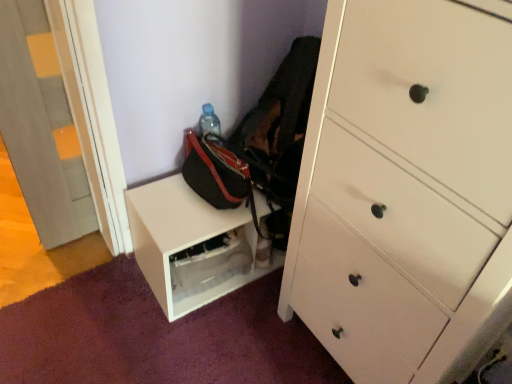
This screenshot has height=384, width=512. In order to click on free space that is to the left of black fabric messenger bag at lower center in this screenshot , I will do `click(162, 200)`.